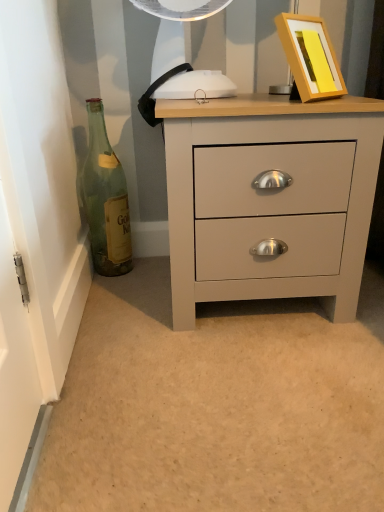
Find the location of a particular element. matte gray chest of drawers at center is located at coordinates (257, 142).

Describe the element at coordinates (257, 142) in the screenshot. I see `matte gray chest of drawers at center` at that location.

Measure the distance between point (324,89) and camera.

Point (324,89) is 32.80 inches away from camera.

This screenshot has width=384, height=512. In order to click on matte gray chest of drawers at center in this screenshot , I will do `click(257, 142)`.

Between green glass bottle at left and yellow matte picture frame at upper right, which one has less height?

yellow matte picture frame at upper right is shorter.

Consider the image. From the image's perspective, is green glass bottle at left under yellow matte picture frame at upper right?

Yes, from the image's perspective, green glass bottle at left is beneath yellow matte picture frame at upper right.

Which is closer to the camera, (94, 153) or (278, 19)?

The point (278, 19) is more forward.

In order to click on bottle directly beneath the yellow matte picture frame at upper right (from a real-world perspective) in this screenshot , I will do point(105,199).

Is green glass bottle at left facing towards matte gray chest of drawers at center?

No, green glass bottle at left is not turned towards matte gray chest of drawers at center.

Is green glass bottle at left behind matte gray chest of drawers at center?

Yes, it is.

From the image's perspective, between green glass bottle at left and matte gray chest of drawers at center, which one is located above?

green glass bottle at left is shown above in the image.

Is matte gray chest of drawers at center oriented away from green glass bottle at left?

matte gray chest of drawers at center does not have its back to green glass bottle at left.

From the image's perspective, which is below, matte gray chest of drawers at center or green glass bottle at left?

matte gray chest of drawers at center is shown below in the image.

In order to click on bottle on the left of the matte gray chest of drawers at center in this screenshot , I will do `click(105, 199)`.

Can we say matte gray chest of drawers at center lies outside green glass bottle at left?

Yes, matte gray chest of drawers at center is outside of green glass bottle at left.

Is matte gray chest of drawers at center aimed at yellow matte picture frame at upper right?

No, matte gray chest of drawers at center is not turned towards yellow matte picture frame at upper right.

Find the location of a particular element. The width and height of the screenshot is (384, 512). picture frame above the matte gray chest of drawers at center (from a real-world perspective) is located at coordinates (310, 57).

Is matte gray chest of drawers at center to the right of yellow matte picture frame at upper right from the viewer's perspective?

Incorrect, matte gray chest of drawers at center is not on the right side of yellow matte picture frame at upper right.

From the image's perspective, would you say matte gray chest of drawers at center is shown under yellow matte picture frame at upper right?

Yes.

Measure the distance from yellow matte picture frame at upper right to matte gray chest of drawers at center.

yellow matte picture frame at upper right is 8.13 inches away from matte gray chest of drawers at center.

Could you tell me if yellow matte picture frame at upper right is turned towards matte gray chest of drawers at center?

No, yellow matte picture frame at upper right is not aimed at matte gray chest of drawers at center.

Is yellow matte picture frame at upper right taller than matte gray chest of drawers at center?

No.

Is yellow matte picture frame at upper right wider or thinner than matte gray chest of drawers at center?

Clearly, yellow matte picture frame at upper right has less width compared to matte gray chest of drawers at center.

Is yellow matte picture frame at upper right next to green glass bottle at left and touching it?

yellow matte picture frame at upper right and green glass bottle at left are clearly separated.

Is green glass bottle at left inside yellow matte picture frame at upper right?

Actually, green glass bottle at left is outside yellow matte picture frame at upper right.

In the scene shown: Which of these two, yellow matte picture frame at upper right or green glass bottle at left, is bigger?

With larger size is yellow matte picture frame at upper right.

Considering the positions of objects yellow matte picture frame at upper right and green glass bottle at left in the image provided, who is more to the right, yellow matte picture frame at upper right or green glass bottle at left?

yellow matte picture frame at upper right is more to the right.

Where is `picture frame above the green glass bottle at left (from the image's perspective)`? This screenshot has height=512, width=384. picture frame above the green glass bottle at left (from the image's perspective) is located at coordinates 310,57.

What are the coordinates of `the chest of drawers below the green glass bottle at left (from the image's perspective)` in the screenshot? It's located at (257, 142).

Looking at this image, considering their positions, is green glass bottle at left positioned closer to matte gray chest of drawers at center than yellow matte picture frame at upper right?

The object closer to matte gray chest of drawers at center is yellow matte picture frame at upper right.

When comparing their distances from yellow matte picture frame at upper right, does green glass bottle at left or matte gray chest of drawers at center seem closer?

matte gray chest of drawers at center lies closer to yellow matte picture frame at upper right than the other object.

Considering their positions, is matte gray chest of drawers at center positioned further to yellow matte picture frame at upper right than green glass bottle at left?

Among the two, green glass bottle at left is located further to yellow matte picture frame at upper right.

From the image, which object appears to be farther from green glass bottle at left, yellow matte picture frame at upper right or matte gray chest of drawers at center?

yellow matte picture frame at upper right is further to green glass bottle at left.

When comparing their distances from matte gray chest of drawers at center, does yellow matte picture frame at upper right or green glass bottle at left seem closer?

yellow matte picture frame at upper right is positioned closer to the anchor matte gray chest of drawers at center.

In the scene shown: Based on their spatial positions, is matte gray chest of drawers at center or yellow matte picture frame at upper right further from green glass bottle at left?

The object further to green glass bottle at left is yellow matte picture frame at upper right.

Image resolution: width=384 pixels, height=512 pixels. In order to click on the chest of drawers situated between green glass bottle at left and yellow matte picture frame at upper right from left to right in this screenshot , I will do `click(257, 142)`.